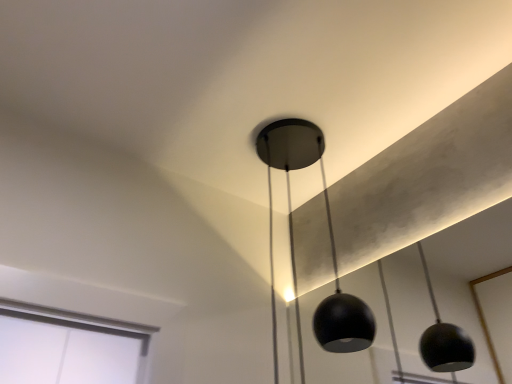
What do you see at coordinates (329, 234) in the screenshot?
I see `matte black pendant light at center` at bounding box center [329, 234].

This screenshot has width=512, height=384. I want to click on matte black pendant light at center, so click(x=329, y=234).

Where is `matte black pendant light at center`? matte black pendant light at center is located at coordinates (329, 234).